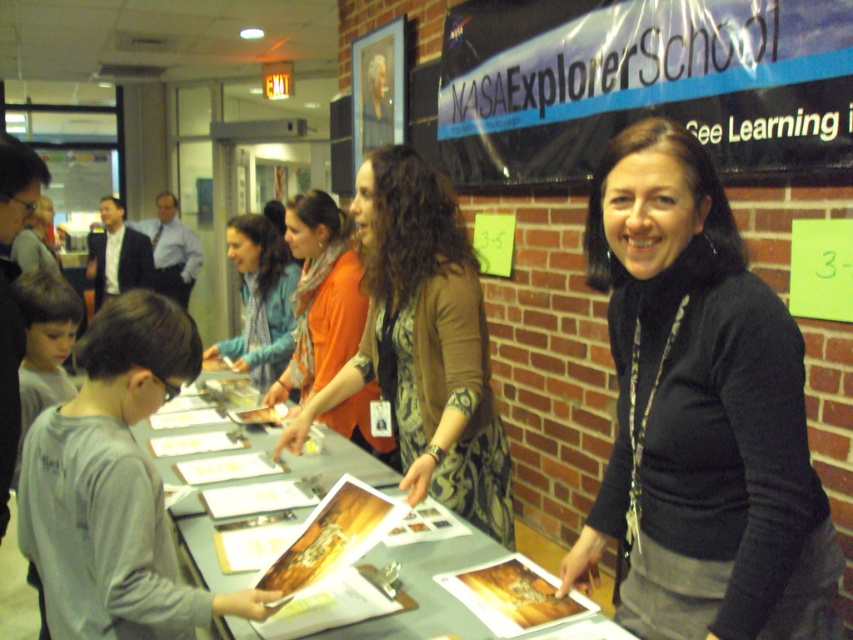
Question: Based on their relative distances, which object is farther from the green paper at center?

Choices:
 (A) green paper at upper right
 (B) matte plastic bagel at center
 (C) wooden cutting board at center
 (D) orange fabric scarf at center

Answer: (C)

Question: Can you confirm if matte orange sweater at center is positioned above matte plastic bagel at center?

Choices:
 (A) yes
 (B) no

Answer: (A)

Question: Can you confirm if blue plastic banner at upper center is bigger than brown textured sweater at center?

Choices:
 (A) yes
 (B) no

Answer: (A)

Question: Can you confirm if green paper at upper right is bigger than golden paper food at center?

Choices:
 (A) no
 (B) yes

Answer: (B)

Question: Among these points, which one is farthest from the camera?

Choices:
 (A) (277, 420)
 (B) (432, 259)
 (C) (271, 312)
 (D) (488, 266)

Answer: (D)

Question: Which is farther from the brown textured sweater at center?

Choices:
 (A) black sweater at center
 (B) wooden cutting board at center
 (C) matte plastic bagel at center

Answer: (C)